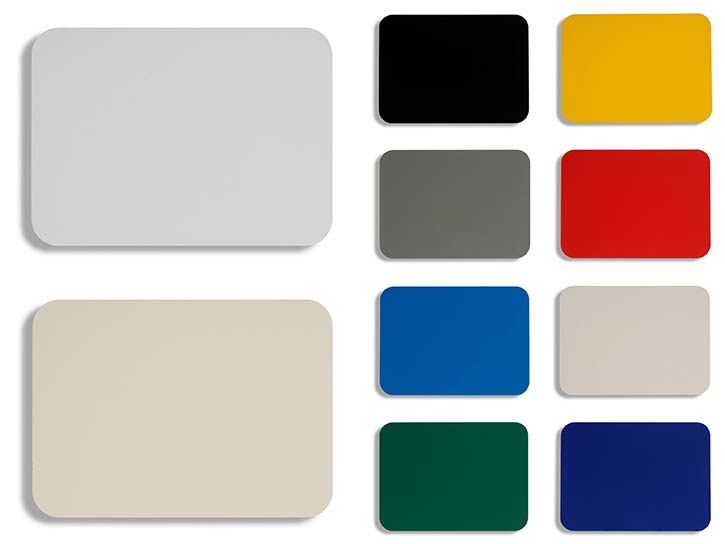
You are a GUI agent. You are given a task and a screenshot of the screen. Output one action in this format:
    pyautogui.click(x=<x>, y=<y>)
    Task: Click on the green tile shadow
    This screenshot has height=544, width=725.
    Given the screenshot: What is the action you would take?
    pyautogui.click(x=377, y=478)